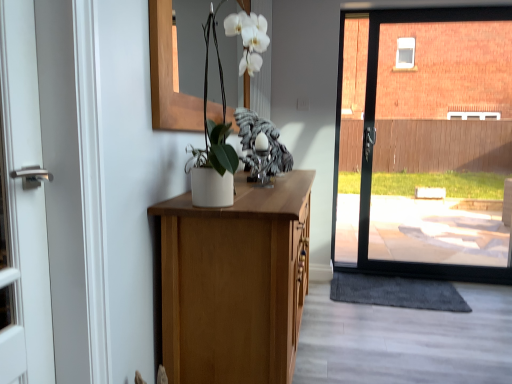
Question: Looking at their shapes, would you say white matte vase at center is wider or thinner than gray textured doormat at lower right?

Choices:
 (A) wide
 (B) thin

Answer: (B)

Question: In terms of height, does white matte vase at center look taller or shorter compared to gray textured doormat at lower right?

Choices:
 (A) short
 (B) tall

Answer: (B)

Question: From a real-world perspective, relative to gray textured doormat at lower right, is white matte vase at center vertically above or below?

Choices:
 (A) above
 (B) below

Answer: (A)

Question: Choose the correct answer: Is gray textured doormat at lower right inside white matte vase at center or outside it?

Choices:
 (A) inside
 (B) outside

Answer: (B)

Question: Is gray textured doormat at lower right bigger or smaller than white matte vase at center?

Choices:
 (A) small
 (B) big

Answer: (A)

Question: From a real-world perspective, is gray textured doormat at lower right physically located above or below white matte vase at center?

Choices:
 (A) below
 (B) above

Answer: (A)

Question: Visually, is gray textured doormat at lower right positioned to the left or to the right of white matte vase at center?

Choices:
 (A) right
 (B) left

Answer: (A)